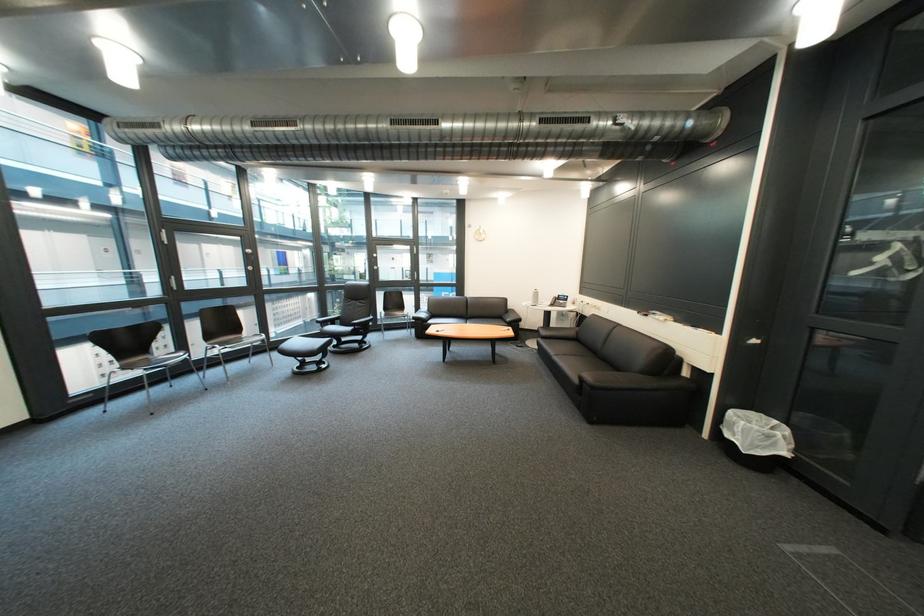
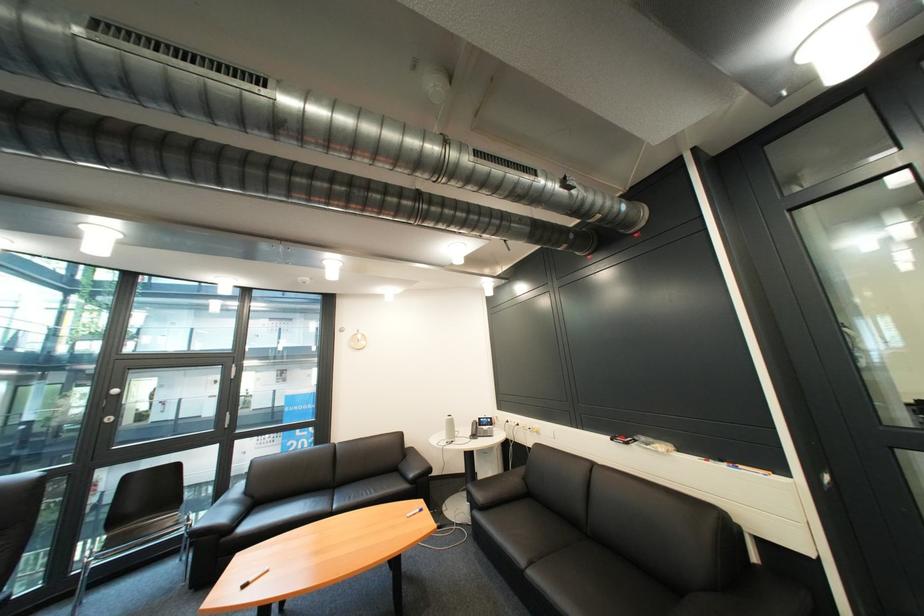
Find the pixel in the second image that matches the point at 703,330 in the first image.

(736, 468)